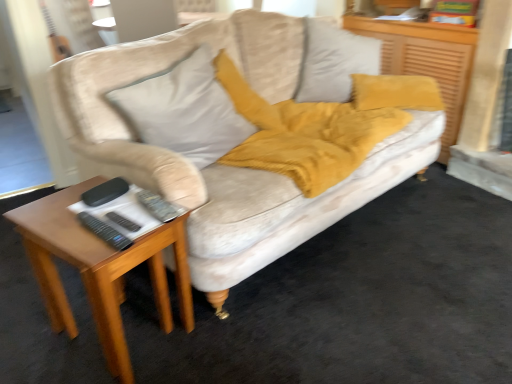
Locate an element on the screen. This screenshot has width=512, height=384. free space that is to the left of black plastic remote at lower left, which is counted as the first remote, starting from the front is located at coordinates (60, 229).